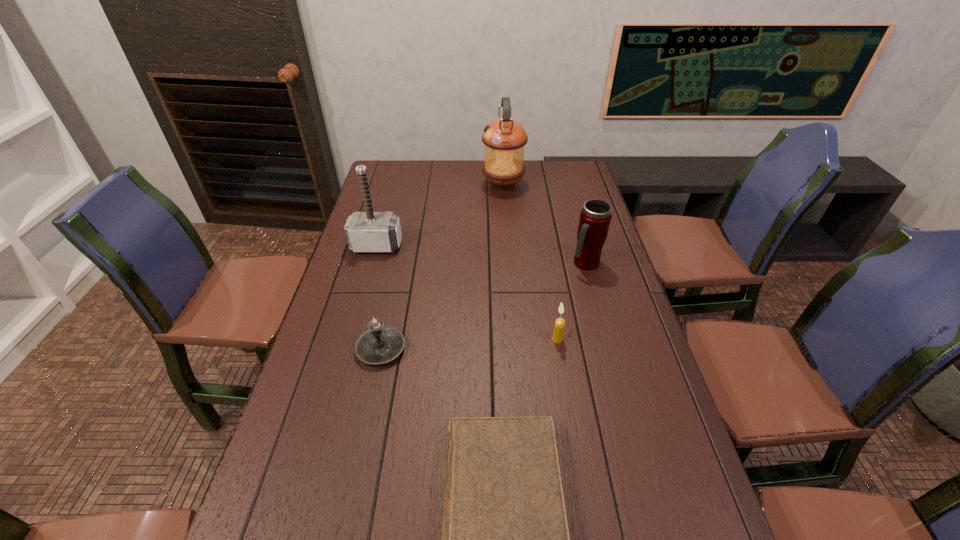
In order to click on the farthest object in this screenshot , I will do `click(504, 139)`.

This screenshot has height=540, width=960. Find the location of `hammer`. hammer is located at coordinates (369, 231).

The image size is (960, 540). I want to click on the rightmost object, so pyautogui.click(x=595, y=217).

Identify the location of the third tallest object. The image size is (960, 540). (595, 217).

The height and width of the screenshot is (540, 960). In order to click on the second object from right to left in this screenshot , I will do `click(559, 328)`.

Locate an element on the screen. The image size is (960, 540). the left candle is located at coordinates (380, 344).

At what (x,y) coordinates should I click in order to perform the action: click on the second shortest object. Please return your answer as a coordinate pair (x, y). Looking at the image, I should click on (380, 344).

I want to click on vacant space situated on the front of the oil lamp, so click(x=506, y=229).

Where is `free space located for striking with the head of the hammer`? The image size is (960, 540). free space located for striking with the head of the hammer is located at coordinates (355, 321).

In order to click on vacant space situated on the side with the handle of the thermos bottle in this screenshot , I will do `click(592, 289)`.